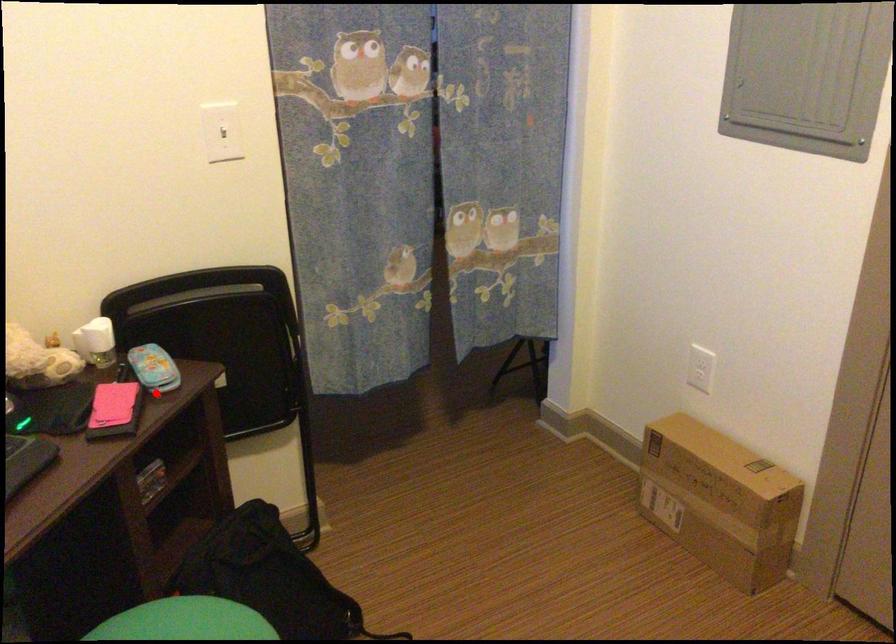
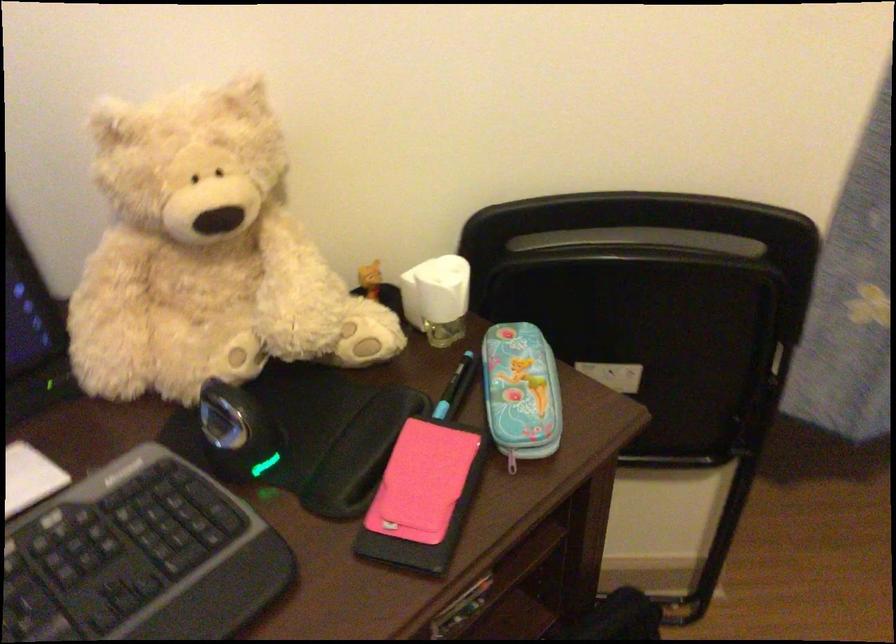
Question: I am providing you with two images of the same scene from different viewpoints. In image1, a red point is highlighted. Considering the same 3D point in image2, which of the following is correct?

Choices:
 (A) It is closer
 (B) It is farther

Answer: (A)